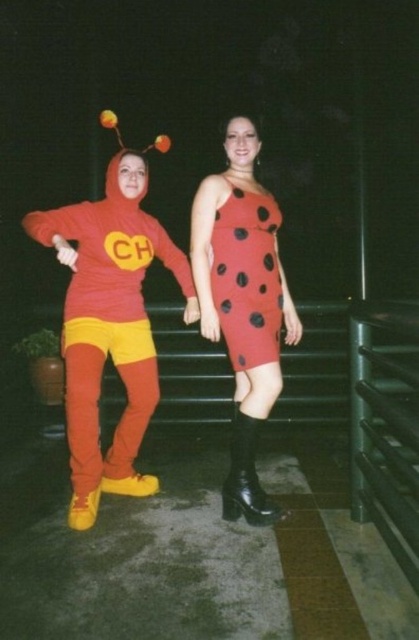
Who is more forward, (250, 353) or (219, 273)?

Positioned in front is point (250, 353).

Is point (242, 237) closer to viewer compared to point (225, 246)?

Yes, it is.

At what (x,y) coordinates should I click in order to perform the action: click on matte red dress with black polka dots at center. Please return your answer as a coordinate pair (x, y). The height and width of the screenshot is (640, 419). Looking at the image, I should click on pos(243,301).

Does matte red costume at left appear on the right side of matte red dress with black polka dots at center?

Incorrect, matte red costume at left is not on the right side of matte red dress with black polka dots at center.

Is matte red costume at left positioned before matte red dress with black polka dots at center?

Yes, matte red costume at left is in front of matte red dress with black polka dots at center.

Image resolution: width=419 pixels, height=640 pixels. Identify the location of matte red costume at left. (243, 300).

Identify the location of matte red costume at left. (243, 300).

Can you confirm if matte red costume at left is positioned above red dotted dress at center?

Incorrect, matte red costume at left is not positioned above red dotted dress at center.

Between point (276, 259) and point (248, 348), which one is positioned behind?

The point (276, 259) is more distant.

Between point (242, 195) and point (261, 307), which one is positioned in front?

Positioned in front is point (261, 307).

Where is `matte red costume at left`? This screenshot has height=640, width=419. matte red costume at left is located at coordinates (243, 300).